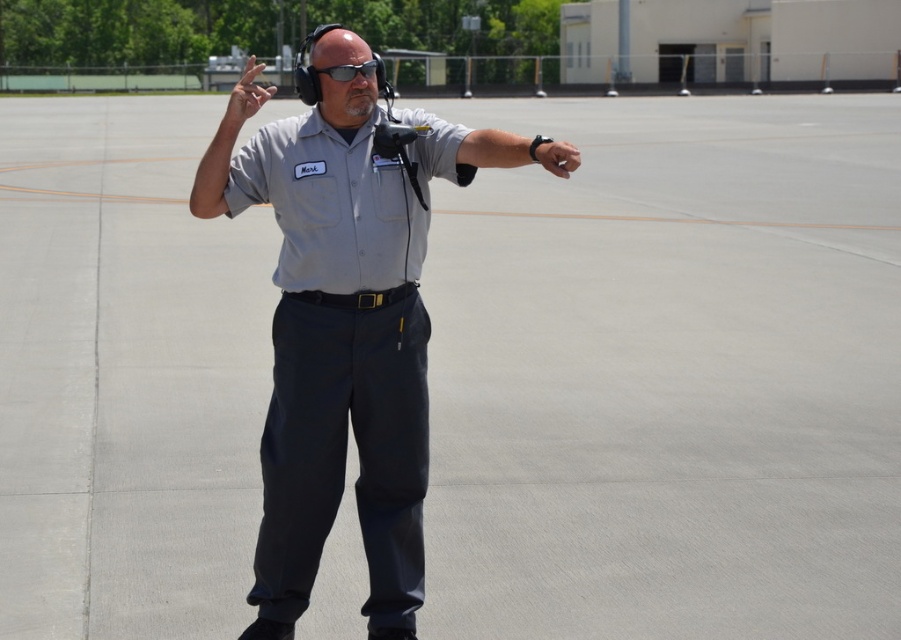
Between black matte watch at center and gray fabric arm at upper center, which one has more height?

gray fabric arm at upper center

Does black matte watch at center come behind gray fabric arm at upper center?

No, it is in front of gray fabric arm at upper center.

The height and width of the screenshot is (640, 901). Describe the element at coordinates (483, 148) in the screenshot. I see `black matte watch at center` at that location.

Where is `black matte watch at center`? black matte watch at center is located at coordinates (483, 148).

Does gray fabric shirt at center have a lesser width compared to black matte watch at center?

No, gray fabric shirt at center is not thinner than black matte watch at center.

Is gray fabric shirt at center wider than black matte watch at center?

Yes.

Between point (413, 355) and point (433, 168), which one is positioned behind?

Point (433, 168)

Find the location of `gray fabric shirt at center`. gray fabric shirt at center is located at coordinates (344, 324).

Between point (363, 232) and point (357, 68), which one is positioned in front?

Positioned in front is point (357, 68).

Can you confirm if gray fabric shirt at center is positioned above matte black goggles at center?

No.

At what (x,y) coordinates should I click in order to perform the action: click on gray fabric shirt at center. Please return your answer as a coordinate pair (x, y). Looking at the image, I should click on (344, 324).